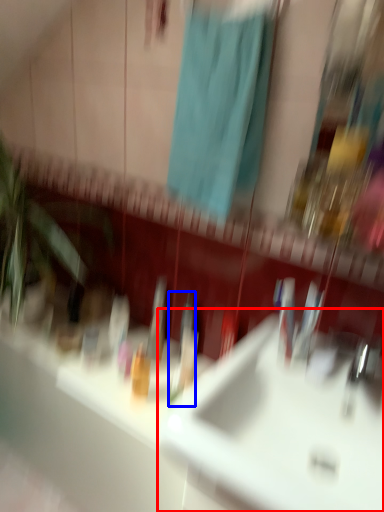
Question: Which object appears closest to the camera in this image, sink (highlighted by a red box) or toothbrush (highlighted by a blue box)?

Choices:
 (A) sink
 (B) toothbrush

Answer: (A)